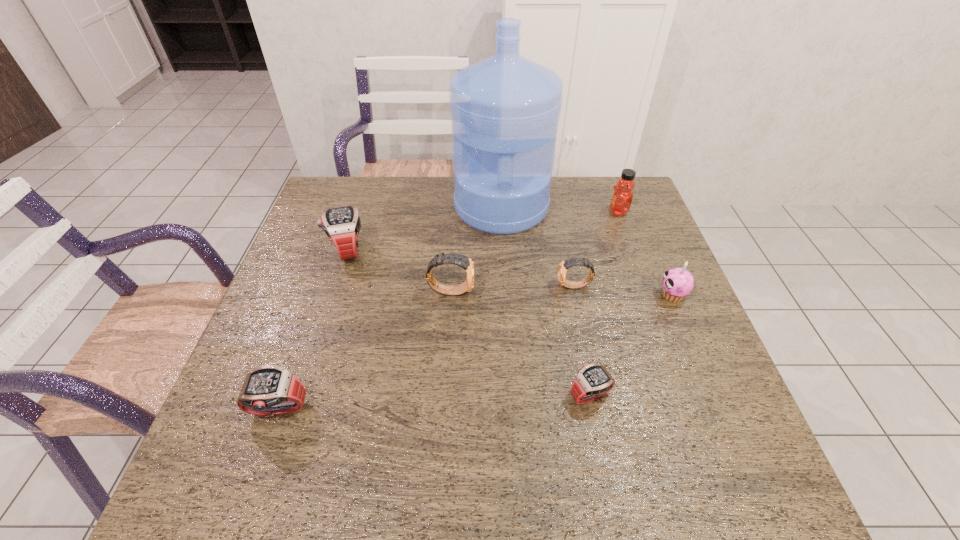
The width and height of the screenshot is (960, 540). I want to click on the shortest object, so click(593, 381).

The width and height of the screenshot is (960, 540). Find the location of `the shortest watch`. the shortest watch is located at coordinates (593, 381).

You are a GUI agent. You are given a task and a screenshot of the screen. Output one action in this format:
    pyautogui.click(x=<x>, y=<y>)
    Task: Click on the free space located on the side of the blue water jug with the handle
    The height and width of the screenshot is (540, 960).
    Given the screenshot: What is the action you would take?
    pyautogui.click(x=504, y=261)

This screenshot has height=540, width=960. I want to click on vacant position located on the front label of the honey, so pyautogui.click(x=588, y=212).

Locate an element on the screen. This screenshot has width=960, height=540. vacant space located on the front label of the honey is located at coordinates (527, 212).

This screenshot has height=540, width=960. I want to click on free space located on the front label of the honey, so click(502, 212).

This screenshot has height=540, width=960. Find the location of `vacant space located 0.180m on the back of the farthest watch`. vacant space located 0.180m on the back of the farthest watch is located at coordinates pos(365,197).

Locate an element on the screen. The image size is (960, 540). vacant space located on the face of the third watch from right to left is located at coordinates (521, 291).

Find the location of a particular element. The image size is (960, 540). blank space located 0.100m on the face of the cupcake is located at coordinates (619, 295).

Identify the location of vacant space located on the face of the cupcake. tap(544, 295).